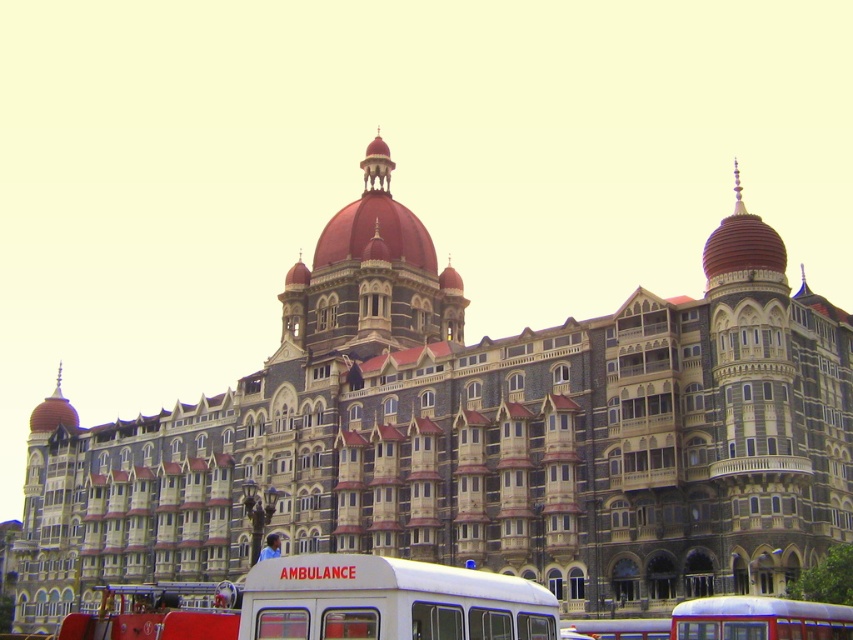
Question: Can you confirm if white matte ambulance at lower center is smaller than white plastic bus at center?

Choices:
 (A) yes
 (B) no

Answer: (B)

Question: Is blue metallic bus at lower right smaller than white plastic bus at center?

Choices:
 (A) yes
 (B) no

Answer: (B)

Question: Which of the following is the closest to the observer?

Choices:
 (A) white matte ambulance at lower center
 (B) white plastic bus at center

Answer: (A)

Question: Which of these objects is positioned farthest from the white plastic bus at center?

Choices:
 (A) white matte ambulance at lower center
 (B) blue metallic bus at lower right

Answer: (A)

Question: Does white matte ambulance at lower center appear under blue metallic bus at lower right?

Choices:
 (A) yes
 (B) no

Answer: (B)

Question: Based on their relative distances, which object is farther from the white plastic bus at center?

Choices:
 (A) white matte ambulance at lower center
 (B) blue metallic bus at lower right

Answer: (A)